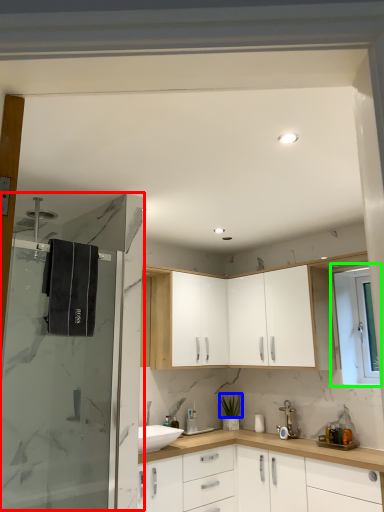
Question: Based on their relative distances, which object is nearer to shower door (highlighted by a red box)? Choose from plant (highlighted by a blue box) and window (highlighted by a green box).

Choices:
 (A) plant
 (B) window

Answer: (A)